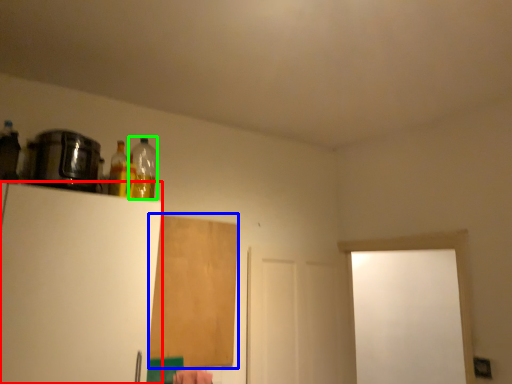
Question: Estimate the real-world distances between objects in this image. Which object is farther from appliance (highlighted by a red box), plywood (highlighted by a blue box) or bottle (highlighted by a green box)?

Choices:
 (A) plywood
 (B) bottle

Answer: (A)